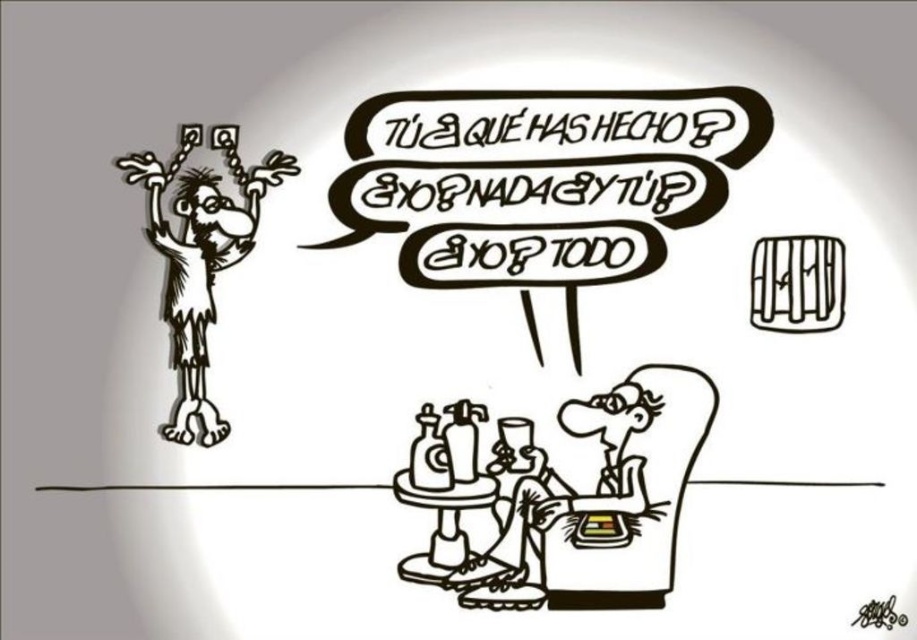
Question: Is white fabric armchair at lower right smaller than smooth skin man at lower center?

Choices:
 (A) no
 (B) yes

Answer: (B)

Question: Which object is closer to the camera taking this photo?

Choices:
 (A) smooth wood stool at lower center
 (B) smooth skin man at lower center
 (C) black ink drawing of man at left

Answer: (B)

Question: Does white fabric armchair at lower right have a greater width compared to smooth wood stool at lower center?

Choices:
 (A) no
 (B) yes

Answer: (B)

Question: Where is black ink drawing of man at left located in relation to smooth wood stool at lower center in the image?

Choices:
 (A) left
 (B) right

Answer: (A)

Question: Which of the following is the closest to the observer?

Choices:
 (A) (244, 204)
 (B) (523, 593)
 (C) (653, 582)
 (D) (449, 493)

Answer: (C)

Question: Among these points, which one is nearest to the camera?

Choices:
 (A) (429, 492)
 (B) (584, 420)

Answer: (B)